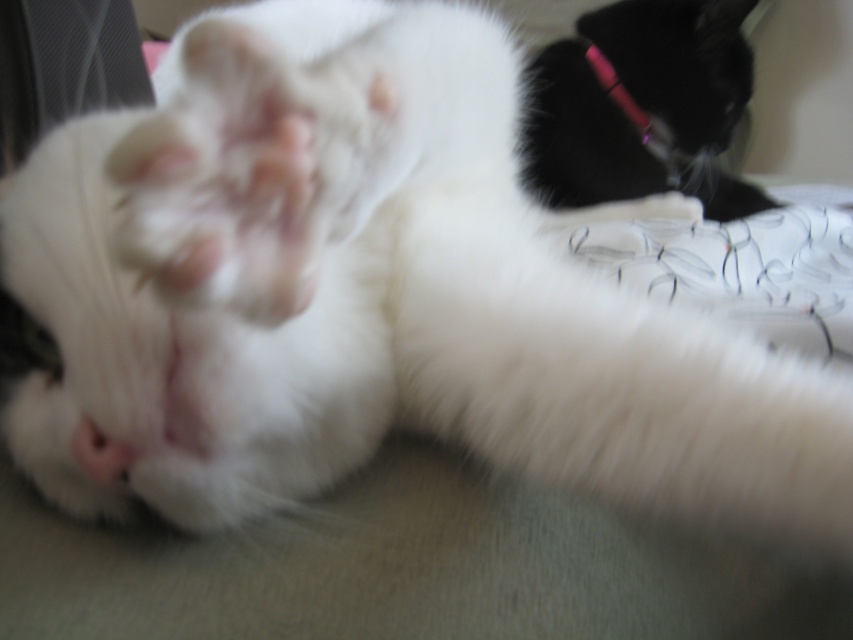
Who is taller, black fur cat at upper right or pink plastic pen at upper right?

black fur cat at upper right

Between point (619, 138) and point (590, 44), which one is positioned behind?

The point (590, 44) is behind.

The image size is (853, 640). Find the location of `black fur cat at upper right`. black fur cat at upper right is located at coordinates (643, 106).

Identify the location of black fur cat at upper right. (643, 106).